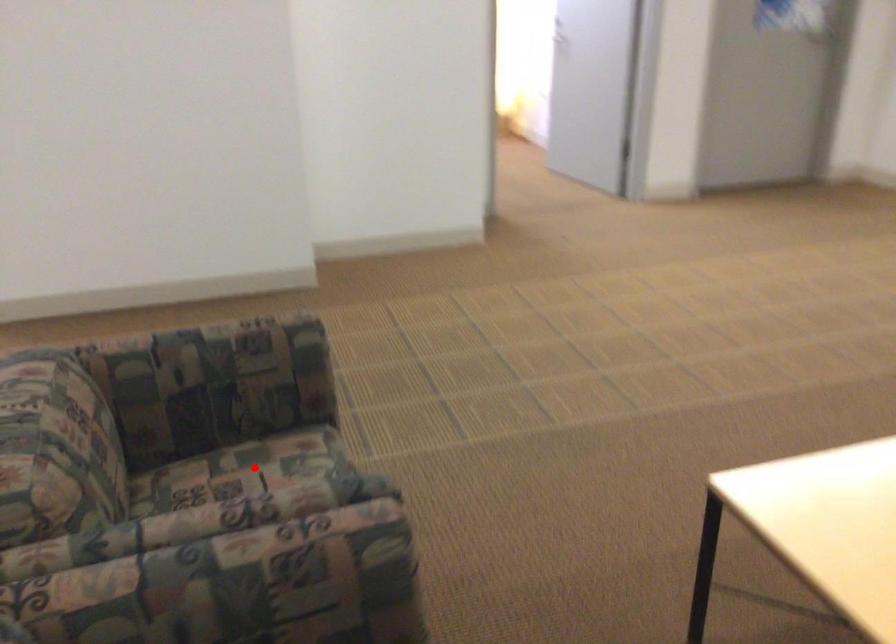
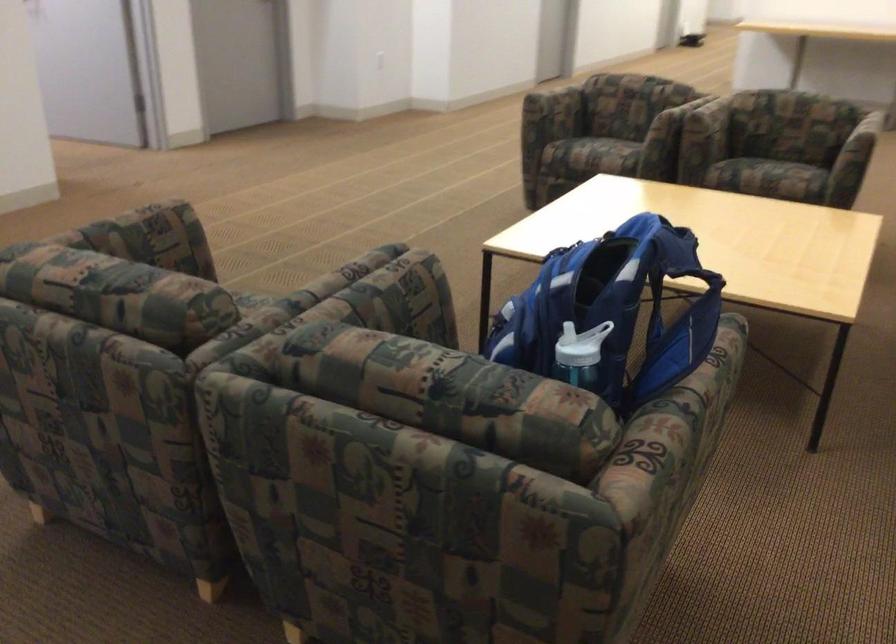
Question: I am providing you with two images of the same scene from different viewpoints. A red point is marked on the first image. Is the red point's position out of view in image 2?

Choices:
 (A) Yes
 (B) No

Answer: (A)